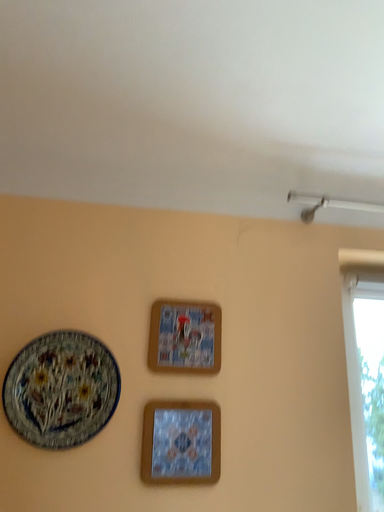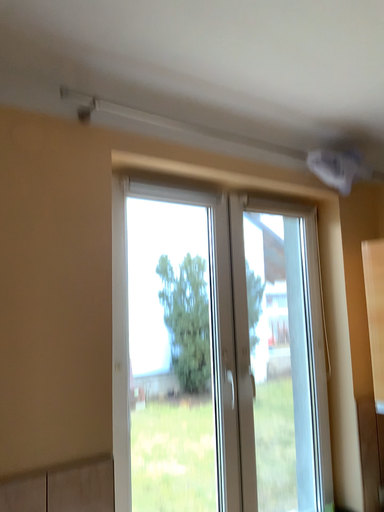
Question: How did the camera likely rotate when shooting the video?

Choices:
 (A) rotated right
 (B) rotated left

Answer: (A)